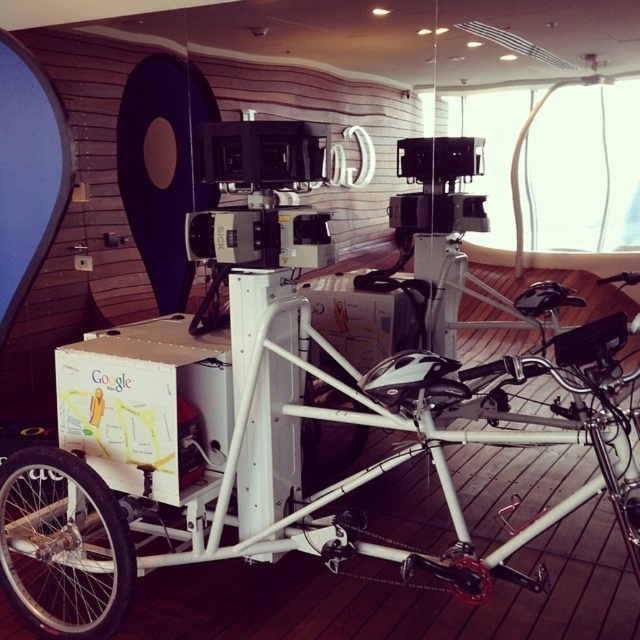
You are a technician inspecting the tricycle vehicle. You notice the white cardboard box at center and the black matte wheel at center. Which object is positioned higher relative to the other?

The white cardboard box at center is located above the black matte wheel at center, so it is positioned higher.